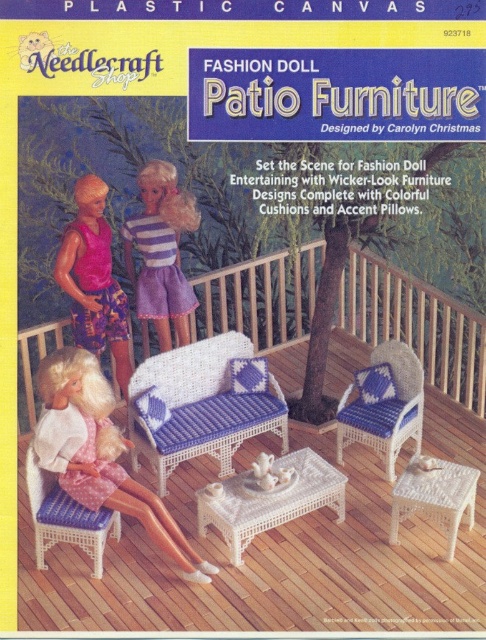
Is point (110, 348) closer to camera compared to point (469, 477)?

That is False.

How far apart are pink fabric doll at upper center and white wicker stool at lower right?

pink fabric doll at upper center and white wicker stool at lower right are 9.35 feet apart from each other.

Find the location of `pink fabric doll at upper center`. pink fabric doll at upper center is located at coordinates (93, 280).

From the picture: How far apart are white wicker chair at lower left and wicker blue cushioned chair at center?

white wicker chair at lower left is 6.58 feet away from wicker blue cushioned chair at center.

Who is more forward, [90,376] or [381,358]?

Positioned in front is point [90,376].

The image size is (486, 640). I want to click on white wicker chair at lower left, so click(x=100, y=452).

Which is above, white wicker bench at center or wicker blue cushioned chair at center?

wicker blue cushioned chair at center is above.

Does white wicker bench at center have a larger size compared to wicker blue cushioned chair at center?

Yes, white wicker bench at center is bigger than wicker blue cushioned chair at center.

You are a GUI agent. You are given a task and a screenshot of the screen. Output one action in this format:
    pyautogui.click(x=<x>, y=<y>)
    Task: Click on the white wicker bench at center
    
    Given the screenshot: What is the action you would take?
    pyautogui.click(x=202, y=406)

Locate an element on the screen. The height and width of the screenshot is (640, 486). white wicker bench at center is located at coordinates (202, 406).